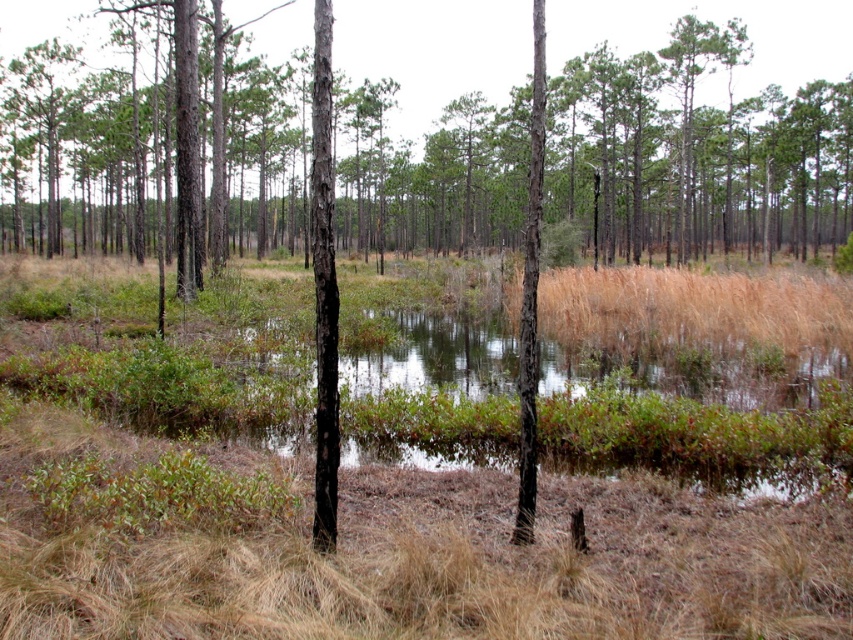
Can you confirm if green bark tree at center is bigger than smooth bark tree at center?

Yes, green bark tree at center is bigger than smooth bark tree at center.

Between point (15, 104) and point (543, 128), which one is positioned behind?

Positioned behind is point (15, 104).

Locate an element on the screen. green bark tree at center is located at coordinates (152, 145).

I want to click on green bark tree at center, so click(x=152, y=145).